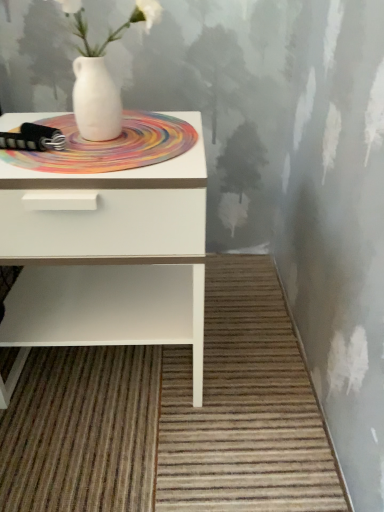
Question: Is white matte vase at upper center oriented towards multicolored woven mat at center?

Choices:
 (A) no
 (B) yes

Answer: (A)

Question: From a real-world perspective, is white matte vase at upper center physically below multicolored woven mat at center?

Choices:
 (A) yes
 (B) no

Answer: (B)

Question: Is white matte vase at upper center not within multicolored woven mat at center?

Choices:
 (A) no
 (B) yes

Answer: (B)

Question: Considering the relative sizes of white matte vase at upper center and multicolored woven mat at center in the image provided, is white matte vase at upper center wider than multicolored woven mat at center?

Choices:
 (A) yes
 (B) no

Answer: (B)

Question: Is white matte vase at upper center next to multicolored woven mat at center?

Choices:
 (A) no
 (B) yes

Answer: (B)

Question: Considering their positions, is white matte vase at upper center located in front of or behind multicolored woven mat at center?

Choices:
 (A) front
 (B) behind

Answer: (A)

Question: Considering the positions of white matte vase at upper center and multicolored woven mat at center in the image, is white matte vase at upper center wider or thinner than multicolored woven mat at center?

Choices:
 (A) wide
 (B) thin

Answer: (B)

Question: From their relative heights in the image, would you say white matte vase at upper center is taller or shorter than multicolored woven mat at center?

Choices:
 (A) tall
 (B) short

Answer: (A)

Question: In terms of size, does white matte vase at upper center appear bigger or smaller than multicolored woven mat at center?

Choices:
 (A) small
 (B) big

Answer: (B)

Question: In terms of width, does white matte vase at upper center look wider or thinner when compared to white glossy nightstand at left?

Choices:
 (A) wide
 (B) thin

Answer: (B)

Question: Is white matte vase at upper center bigger or smaller than white glossy nightstand at left?

Choices:
 (A) small
 (B) big

Answer: (A)

Question: From a real-world perspective, is white matte vase at upper center positioned above or below white glossy nightstand at left?

Choices:
 (A) above
 (B) below

Answer: (A)

Question: Does point (148, 0) appear closer or farther from the camera than point (41, 298)?

Choices:
 (A) farther
 (B) closer

Answer: (B)

Question: Considering the positions of multicolored woven mat at center and white glossy nightstand at left in the image, is multicolored woven mat at center wider or thinner than white glossy nightstand at left?

Choices:
 (A) thin
 (B) wide

Answer: (A)

Question: From their relative heights in the image, would you say multicolored woven mat at center is taller or shorter than white glossy nightstand at left?

Choices:
 (A) short
 (B) tall

Answer: (A)